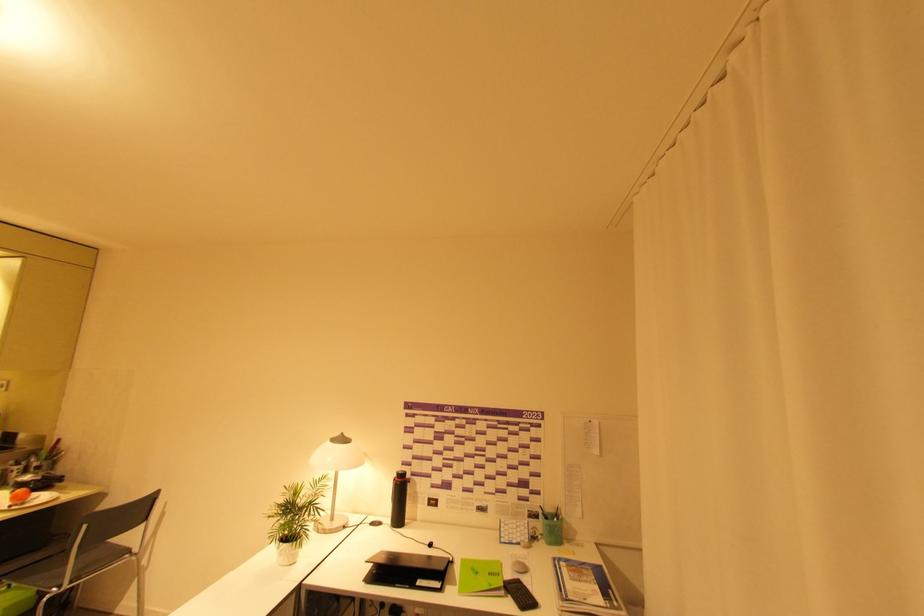
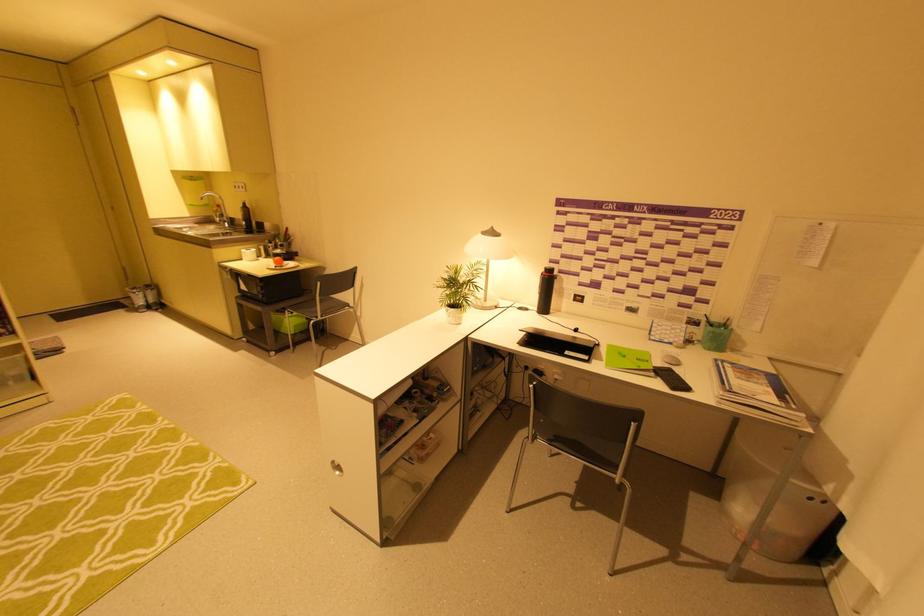
Find the pixel in the second image that matches point 399,476 in the first image.

(546, 270)